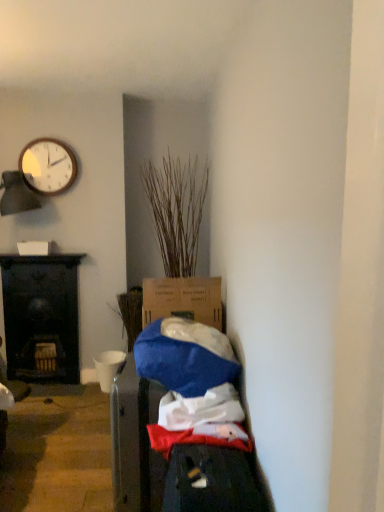
Question: Could dry grass at center be considered to be inside matte white clock at upper left?

Choices:
 (A) no
 (B) yes

Answer: (A)

Question: Does matte white clock at upper left have a greater width compared to dry grass at center?

Choices:
 (A) yes
 (B) no

Answer: (B)

Question: Does matte white clock at upper left turn towards dry grass at center?

Choices:
 (A) no
 (B) yes

Answer: (A)

Question: Is matte white clock at upper left shorter than dry grass at center?

Choices:
 (A) yes
 (B) no

Answer: (A)

Question: From the image's perspective, is matte white clock at upper left above dry grass at center?

Choices:
 (A) no
 (B) yes

Answer: (B)

Question: Considering the positions of dry grass at center and matte white clock at upper left in the image, is dry grass at center bigger or smaller than matte white clock at upper left?

Choices:
 (A) big
 (B) small

Answer: (A)

Question: Which is correct: dry grass at center is inside matte white clock at upper left, or outside of it?

Choices:
 (A) inside
 (B) outside

Answer: (B)

Question: In the image, is dry grass at center positioned in front of or behind matte white clock at upper left?

Choices:
 (A) front
 (B) behind

Answer: (A)

Question: Would you say dry grass at center is to the left or to the right of matte white clock at upper left in the picture?

Choices:
 (A) left
 (B) right

Answer: (B)

Question: In terms of size, does black wood desk at left appear bigger or smaller than matte white clock at upper left?

Choices:
 (A) big
 (B) small

Answer: (A)

Question: Considering the positions of black wood desk at left and matte white clock at upper left in the image, is black wood desk at left taller or shorter than matte white clock at upper left?

Choices:
 (A) short
 (B) tall

Answer: (B)

Question: Is black wood desk at left wider or thinner than matte white clock at upper left?

Choices:
 (A) wide
 (B) thin

Answer: (A)

Question: In the image, is black wood desk at left positioned in front of or behind matte white clock at upper left?

Choices:
 (A) behind
 (B) front

Answer: (A)

Question: From a real-world perspective, relative to black wood desk at left, is matte white clock at upper left vertically above or below?

Choices:
 (A) above
 (B) below

Answer: (A)

Question: Is matte white clock at upper left in front of or behind black wood desk at left in the image?

Choices:
 (A) front
 (B) behind

Answer: (A)